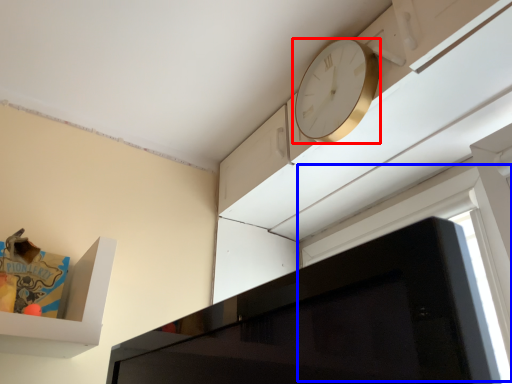
Question: Which of the following is the closest to the observer, clock (highlighted by a red box) or window (highlighted by a blue box)?

Choices:
 (A) clock
 (B) window

Answer: (B)